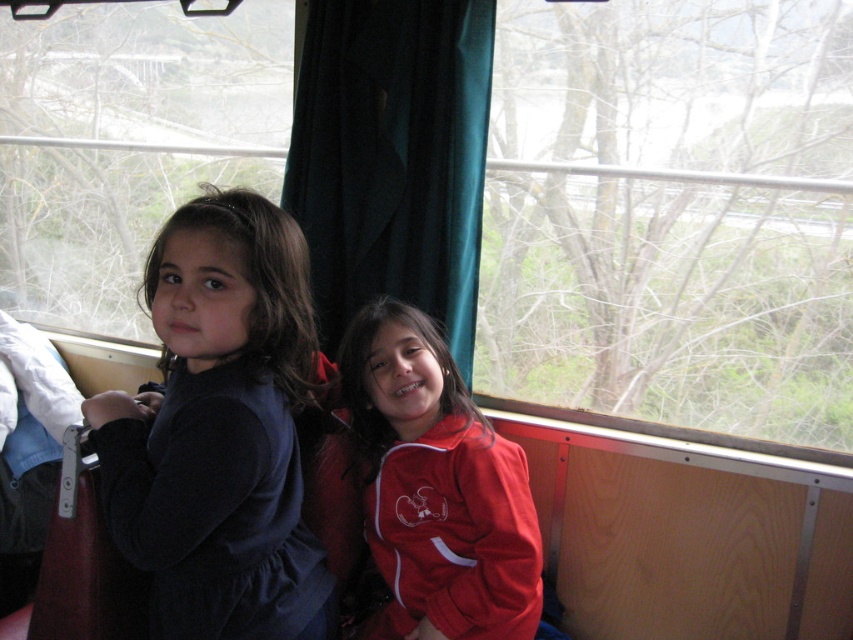
Question: Does velvet dark blue dress at left appear on the right side of red matte jacket at center?

Choices:
 (A) yes
 (B) no

Answer: (B)

Question: Does transparent glass window at center lie in front of red matte jacket at center?

Choices:
 (A) no
 (B) yes

Answer: (A)

Question: Which object is closer to the camera taking this photo?

Choices:
 (A) transparent glass window at center
 (B) red matte jacket at center
 (C) transparent glass window at upper left
 (D) velvet dark blue dress at left

Answer: (D)

Question: Is transparent glass window at center thinner than transparent glass window at upper left?

Choices:
 (A) yes
 (B) no

Answer: (A)

Question: Which point is farther from the camera taking this photo?

Choices:
 (A) pos(692,145)
 (B) pos(473,556)

Answer: (A)

Question: Among these points, which one is nearest to the camera?

Choices:
 (A) (585, 310)
 (B) (274, 157)

Answer: (A)